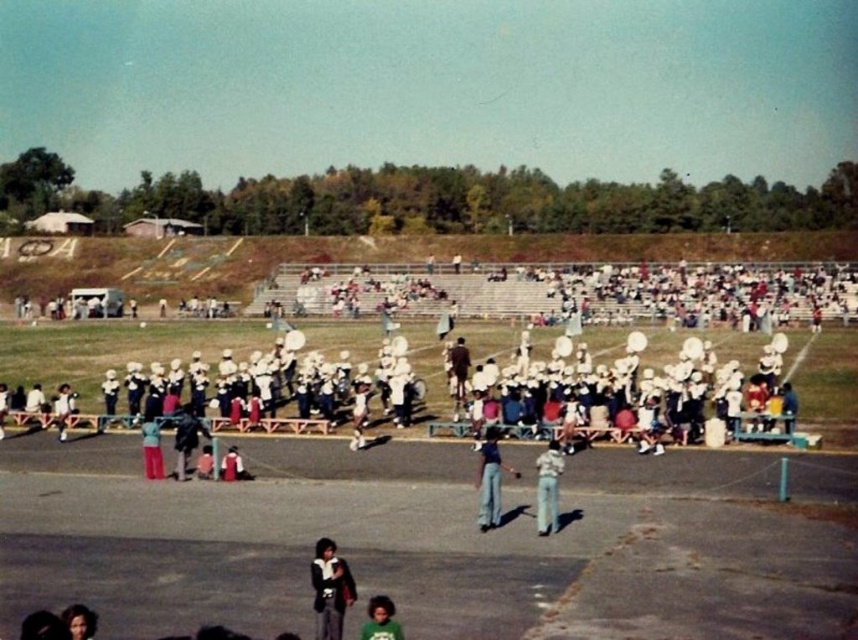
You are a photographer trying to capture a clear shot of both the dark brown leather jacket at lower center and the green matte shirt at lower center. Based on their positions, which one might block the other from view if they are standing close together?

The dark brown leather jacket at lower center might block the green matte shirt at lower center from view because it is wider than the green matte shirt at lower center.